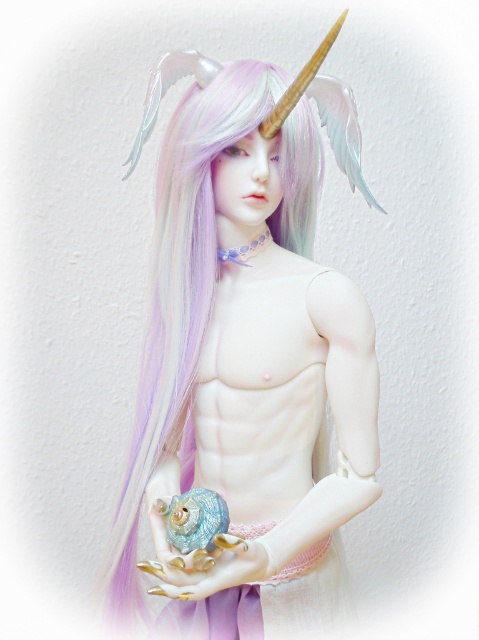
You are an artist trying to draw the pastel matte unicorn horn at upper center. According to the image, where exactly is the horn positioned relative to the figure?

The pastel matte unicorn horn at upper center is located at point coordinates 0.559 on the x axis and 0.520 on the y axis.

You are an artist creating a sculpture of the figure. You need to decide the order to paint the pastel matte unicorn horn at upper center and the gold metallic nails at center. Which object should you paint first to ensure proper layering?

The pastel matte unicorn horn at upper center should be painted first because it is closer to the viewer than the gold metallic nails at center, allowing the nails to be layered over it if needed.